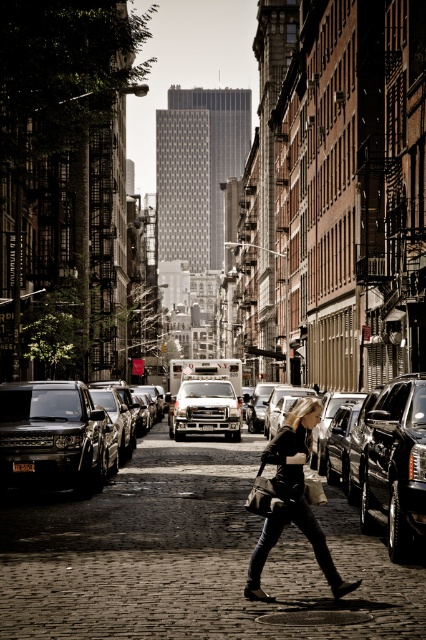
Who is positioned more to the left, black leather jacket at center or white matte van at center?

white matte van at center is more to the left.

Can you confirm if black leather jacket at center is positioned above white matte van at center?

Indeed, black leather jacket at center is positioned over white matte van at center.

Locate an element on the screen. The width and height of the screenshot is (426, 640). black leather jacket at center is located at coordinates (291, 499).

Is shiny black suv at right thinner than white matte van at center?

No, shiny black suv at right is not thinner than white matte van at center.

Measure the distance between shiny black suv at right and camera.

A distance of 34.33 feet exists between shiny black suv at right and camera.

You are a GUI agent. You are given a task and a screenshot of the screen. Output one action in this format:
    pyautogui.click(x=<x>, y=<y>)
    Task: Click on the shiny black suv at right
    The width and height of the screenshot is (426, 640).
    Given the screenshot: What is the action you would take?
    pyautogui.click(x=396, y=465)

Which is behind, point (420, 433) or point (247, 595)?

Positioned behind is point (420, 433).

Is point (365, 483) positioned in front of point (250, 596)?

No, (365, 483) is further to viewer.

Who is more forward, [414,484] or [264,528]?

Point [264,528] is in front.

This screenshot has width=426, height=640. Identify the location of shiny black suv at right. (396, 465).